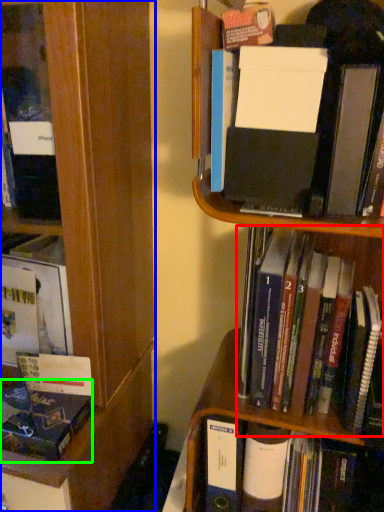
Question: Which is farther away from book (highlighted by a red box)? bookcase (highlighted by a blue box) or book (highlighted by a green box)?

Choices:
 (A) bookcase
 (B) book

Answer: (B)